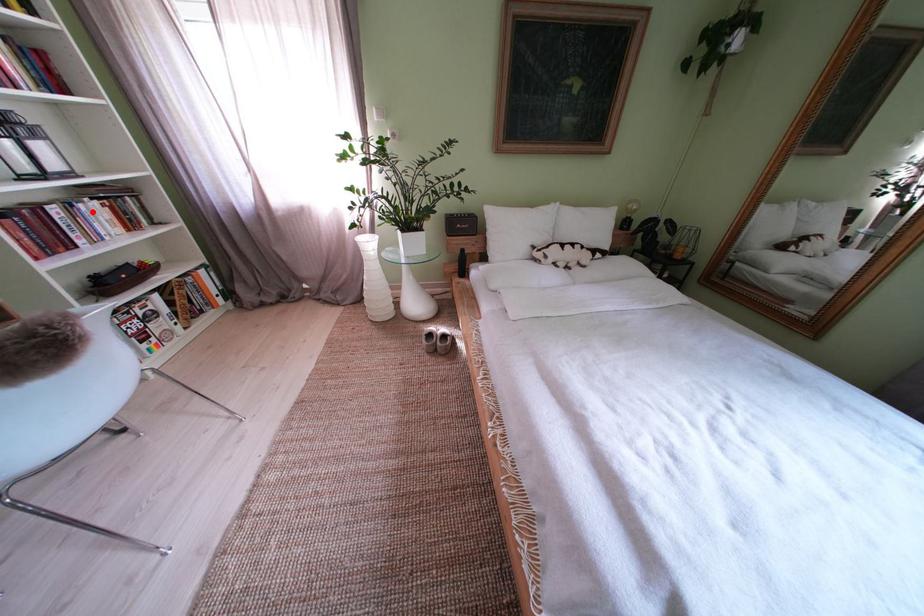
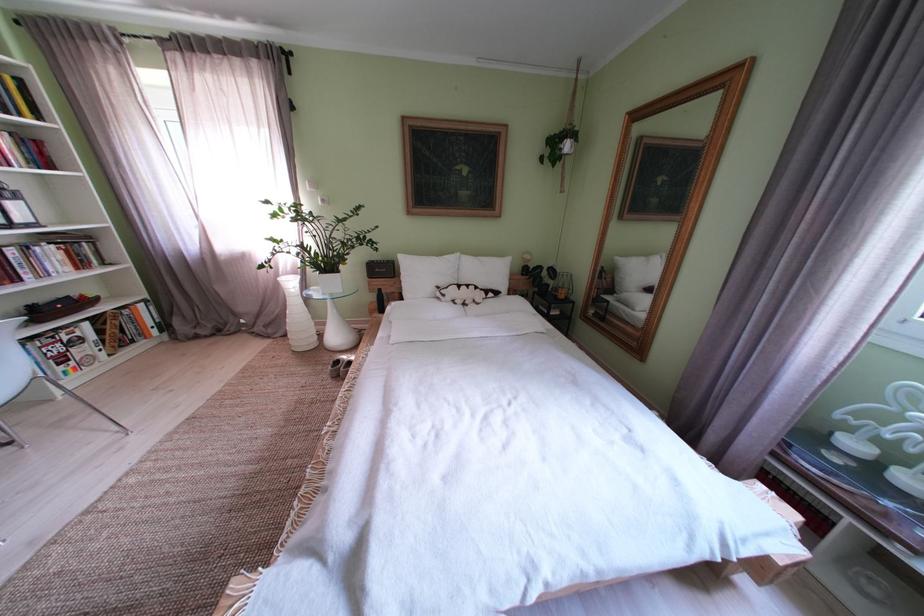
Where in the second image is the point corresponding to the highlighted location from the first image?

(49, 254)